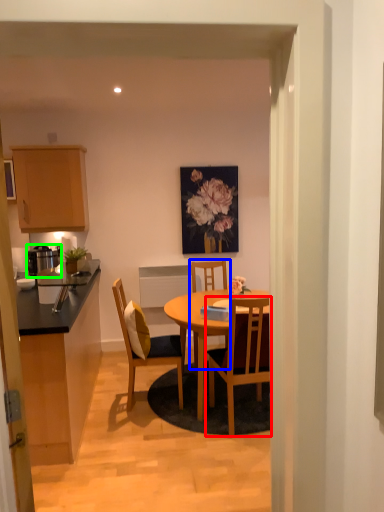
Question: Considering the real-world distances, which object is closest to chair (highlighted by a red box)? chair (highlighted by a blue box) or appliance (highlighted by a green box).

Choices:
 (A) chair
 (B) appliance

Answer: (A)